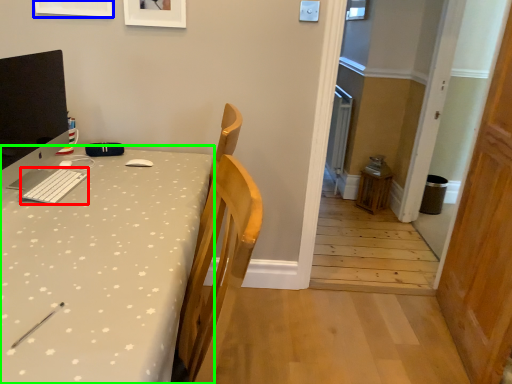
Question: Estimate the real-world distances between objects in this image. Which object is farther from keyboard (highlighted by a red box), picture frame (highlighted by a blue box) or desk (highlighted by a green box)?

Choices:
 (A) picture frame
 (B) desk

Answer: (A)